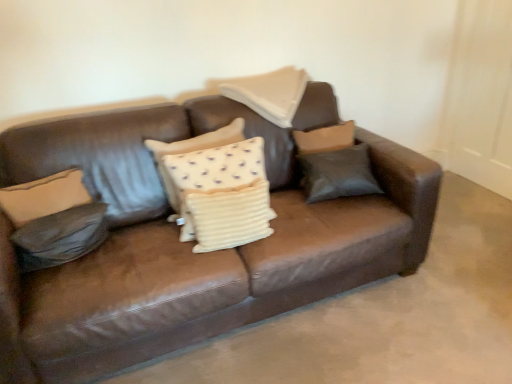
What do you see at coordinates (224, 191) in the screenshot? This screenshot has height=384, width=512. I see `white textured pillow at center, the fourth pillow from the right` at bounding box center [224, 191].

Image resolution: width=512 pixels, height=384 pixels. What are the coordinates of `white textured pillow at center, acting as the third pillow starting from the right` in the screenshot? It's located at (229, 215).

Locate an element on the screen. The height and width of the screenshot is (384, 512). leather pillow at left, which is counted as the first pillow, starting from the left is located at coordinates (60, 236).

What do you see at coordinates (270, 93) in the screenshot? This screenshot has width=512, height=384. I see `beige fabric pillow at center, the 4th pillow viewed from the left` at bounding box center [270, 93].

The width and height of the screenshot is (512, 384). Find the location of `brown leather couch at center`. brown leather couch at center is located at coordinates (191, 245).

Find the location of a particular element. white textured pillow at center, the fourth pillow from the right is located at coordinates click(224, 191).

From a real-world perspective, is matte brown pillow at center, which ranks as the 1th pillow in right-to-left order, on beige fabric pillow at center, the 4th pillow viewed from the left?

Incorrect, from a real-world perspective, matte brown pillow at center, which ranks as the 1th pillow in right-to-left order, is lower than beige fabric pillow at center, the 4th pillow viewed from the left.

Does matte brown pillow at center, which ranks as the 1th pillow in right-to-left order, turn towards beige fabric pillow at center, the 2th pillow when ordered from right to left?

No, matte brown pillow at center, which ranks as the 1th pillow in right-to-left order, is not aimed at beige fabric pillow at center, the 2th pillow when ordered from right to left.

From the image's perspective, is matte brown pillow at center, which ranks as the 1th pillow in right-to-left order, over beige fabric pillow at center, the 2th pillow when ordered from right to left?

No.

Between white textured pillow at center, the fourth pillow from the right, and white textured pillow at center, acting as the third pillow starting from the right, which one has smaller size?

white textured pillow at center, acting as the third pillow starting from the right, is smaller.

Considering the relative sizes of white textured pillow at center, the fourth pillow from the right, and white textured pillow at center, acting as the third pillow starting from the right, in the image provided, is white textured pillow at center, the fourth pillow from the right, wider than white textured pillow at center, acting as the third pillow starting from the right,?

Correct, the width of white textured pillow at center, the fourth pillow from the right, exceeds that of white textured pillow at center, acting as the third pillow starting from the right.

From the image's perspective, which is below, white textured pillow at center, positioned as the 2th pillow in left-to-right order, or white textured pillow at center, the 3th pillow when ordered from left to right?

From the image's view, white textured pillow at center, the 3th pillow when ordered from left to right, is below.

Would you say white textured pillow at center, the fourth pillow from the right, is outside white textured pillow at center, the 3th pillow when ordered from left to right?

white textured pillow at center, the fourth pillow from the right, is positioned outside white textured pillow at center, the 3th pillow when ordered from left to right.

What's the angular difference between beige fabric pillow at center, the 2th pillow when ordered from right to left, and brown leather couch at center's facing directions?

The facing directions of beige fabric pillow at center, the 2th pillow when ordered from right to left, and brown leather couch at center are 1.75 degrees apart.

From the image's perspective, is beige fabric pillow at center, the 2th pillow when ordered from right to left, below brown leather couch at center?

No, from the image's perspective, beige fabric pillow at center, the 2th pillow when ordered from right to left, is not beneath brown leather couch at center.

Are beige fabric pillow at center, the 4th pillow viewed from the left, and brown leather couch at center making contact?

beige fabric pillow at center, the 4th pillow viewed from the left, is not next to brown leather couch at center, and they're not touching.

Who is bigger, beige fabric pillow at center, the 4th pillow viewed from the left, or brown leather couch at center?

brown leather couch at center is bigger.

Starting from the leather pillow at left, which is counted as the first pillow, starting from the left, which pillow is the 2nd one behind? Please provide its 2D coordinates.

[(224, 191)]

How many degrees apart are the facing directions of leather pillow at left, which ranks as the 5th pillow in right-to-left order, and white textured pillow at center, the fourth pillow from the right?

25.4 degrees.

Consider the image. From the image's perspective, is leather pillow at left, which is counted as the first pillow, starting from the left, on white textured pillow at center, positioned as the 2th pillow in left-to-right order?

No, from the image's perspective, leather pillow at left, which is counted as the first pillow, starting from the left, is not above white textured pillow at center, positioned as the 2th pillow in left-to-right order.

From a real-world perspective, is leather pillow at left, which ranks as the 5th pillow in right-to-left order, above or below white textured pillow at center, the fourth pillow from the right?

leather pillow at left, which ranks as the 5th pillow in right-to-left order, is below white textured pillow at center, the fourth pillow from the right.

From a real-world perspective, is beige fabric pillow at center, the 4th pillow viewed from the left, beneath leather pillow at left, which ranks as the 5th pillow in right-to-left order?

No, from a real-world perspective, beige fabric pillow at center, the 4th pillow viewed from the left, is not below leather pillow at left, which ranks as the 5th pillow in right-to-left order.

Is beige fabric pillow at center, the 2th pillow when ordered from right to left, far away from leather pillow at left, which ranks as the 5th pillow in right-to-left order?

No, beige fabric pillow at center, the 2th pillow when ordered from right to left, is in close proximity to leather pillow at left, which ranks as the 5th pillow in right-to-left order.

From the image's perspective, is beige fabric pillow at center, the 4th pillow viewed from the left, beneath leather pillow at left, which is counted as the first pillow, starting from the left?

No.

Measure the distance from beige fabric pillow at center, the 4th pillow viewed from the left, to leather pillow at left, which is counted as the first pillow, starting from the left.

beige fabric pillow at center, the 4th pillow viewed from the left, is 39.28 inches from leather pillow at left, which is counted as the first pillow, starting from the left.

Who is shorter, white textured pillow at center, acting as the third pillow starting from the right, or white textured pillow at center, the fourth pillow from the right?

white textured pillow at center, acting as the third pillow starting from the right.

Considering the positions of objects white textured pillow at center, acting as the third pillow starting from the right, and white textured pillow at center, the fourth pillow from the right, in the image provided, who is more to the right, white textured pillow at center, acting as the third pillow starting from the right, or white textured pillow at center, the fourth pillow from the right,?

white textured pillow at center, acting as the third pillow starting from the right, is more to the right.

Is white textured pillow at center, acting as the third pillow starting from the right, bigger or smaller than white textured pillow at center, positioned as the 2th pillow in left-to-right order?

Considering their sizes, white textured pillow at center, acting as the third pillow starting from the right, takes up less space than white textured pillow at center, positioned as the 2th pillow in left-to-right order.

Can you confirm if white textured pillow at center, the 3th pillow when ordered from left to right, is wider than white textured pillow at center, positioned as the 2th pillow in left-to-right order?

In fact, white textured pillow at center, the 3th pillow when ordered from left to right, might be narrower than white textured pillow at center, positioned as the 2th pillow in left-to-right order.

Is brown leather couch at center positioned with its back to matte brown pillow at center, the fifth pillow from the left?

brown leather couch at center does not have its back to matte brown pillow at center, the fifth pillow from the left.

Which point is more distant from viewer, (165, 205) or (362, 152)?

The point (362, 152) is more distant.

What's the angular difference between brown leather couch at center and matte brown pillow at center, the fifth pillow from the left,'s facing directions?

They differ by 11.2 degrees in their facing directions.

From a real-world perspective, which is physically below, brown leather couch at center or matte brown pillow at center, the fifth pillow from the left?

From a 3D spatial view, brown leather couch at center is below.

From the image's perspective, which pillow is the 1st one below the beige fabric pillow at center, the 4th pillow viewed from the left? Please provide its 2D coordinates.

[(337, 174)]

Locate an element on the screen. the 1st pillow positioned above the white textured pillow at center, the 3th pillow when ordered from left to right (from the image's perspective) is located at coordinates (224, 191).

Estimate the real-world distances between objects in this image. Which object is closer to matte brown pillow at center, the fifth pillow from the left, leather pillow at left, which ranks as the 5th pillow in right-to-left order, or white textured pillow at center, positioned as the 2th pillow in left-to-right order?

white textured pillow at center, positioned as the 2th pillow in left-to-right order, is closer to matte brown pillow at center, the fifth pillow from the left.

Which object lies nearer to the anchor point beige fabric pillow at center, the 2th pillow when ordered from right to left, matte brown pillow at center, the fifth pillow from the left, or white textured pillow at center, positioned as the 2th pillow in left-to-right order?

matte brown pillow at center, the fifth pillow from the left.

Looking at the image, which one is located further to white textured pillow at center, the 3th pillow when ordered from left to right, leather pillow at left, which ranks as the 5th pillow in right-to-left order, or beige fabric pillow at center, the 2th pillow when ordered from right to left?

Among the two, beige fabric pillow at center, the 2th pillow when ordered from right to left, is located further to white textured pillow at center, the 3th pillow when ordered from left to right.

Considering their positions, is white textured pillow at center, acting as the third pillow starting from the right, positioned closer to brown leather couch at center than beige fabric pillow at center, the 4th pillow viewed from the left?

white textured pillow at center, acting as the third pillow starting from the right.

Looking at the image, which one is located closer to leather pillow at left, which is counted as the first pillow, starting from the left, beige fabric pillow at center, the 4th pillow viewed from the left, or matte brown pillow at center, the fifth pillow from the left?

beige fabric pillow at center, the 4th pillow viewed from the left, lies closer to leather pillow at left, which is counted as the first pillow, starting from the left, than the other object.

From the image, which object appears to be farther from leather pillow at left, which ranks as the 5th pillow in right-to-left order, white textured pillow at center, positioned as the 2th pillow in left-to-right order, or brown leather couch at center?

white textured pillow at center, positioned as the 2th pillow in left-to-right order, is further to leather pillow at left, which ranks as the 5th pillow in right-to-left order.

Which object lies nearer to the anchor point leather pillow at left, which is counted as the first pillow, starting from the left, matte brown pillow at center, which ranks as the 1th pillow in right-to-left order, or white textured pillow at center, the fourth pillow from the right?

white textured pillow at center, the fourth pillow from the right, is positioned closer to the anchor leather pillow at left, which is counted as the first pillow, starting from the left.

When comparing their distances from beige fabric pillow at center, the 4th pillow viewed from the left, does white textured pillow at center, the fourth pillow from the right, or leather pillow at left, which is counted as the first pillow, starting from the left, seem further?

The object further to beige fabric pillow at center, the 4th pillow viewed from the left, is leather pillow at left, which is counted as the first pillow, starting from the left.

Where is `studio couch located between leather pillow at left, which is counted as the first pillow, starting from the left, and matte brown pillow at center, the fifth pillow from the left, in the left-right direction`? studio couch located between leather pillow at left, which is counted as the first pillow, starting from the left, and matte brown pillow at center, the fifth pillow from the left, in the left-right direction is located at coordinates (191, 245).

Find the location of a particular element. The height and width of the screenshot is (384, 512). pillow situated between leather pillow at left, which is counted as the first pillow, starting from the left, and white textured pillow at center, acting as the third pillow starting from the right, from left to right is located at coordinates (224, 191).